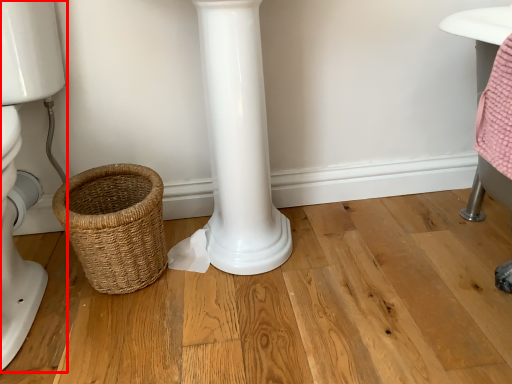
Question: From the image's perspective, considering the relative positions of toilet (annotated by the red box) and basket in the image provided, where is toilet (annotated by the red box) located with respect to the staircase?

Choices:
 (A) above
 (B) below

Answer: (A)